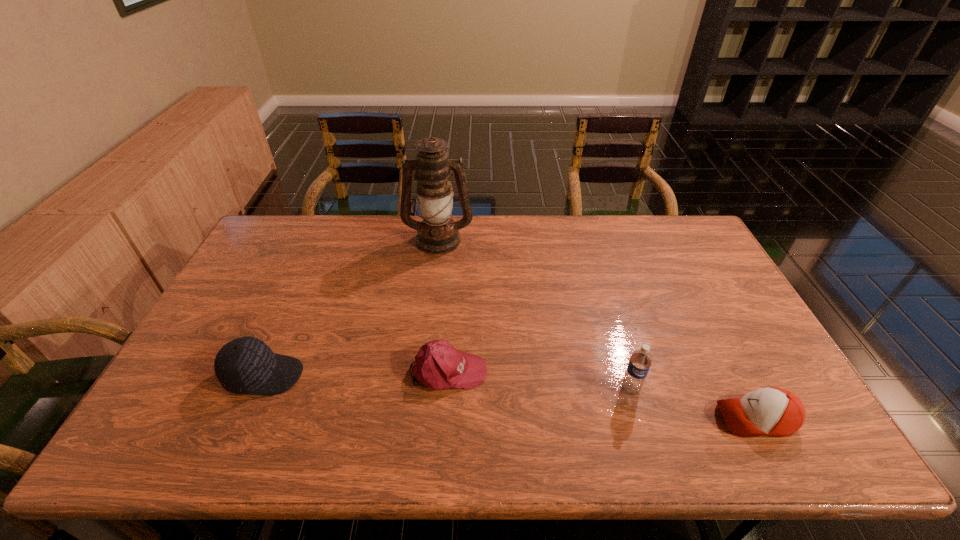
Identify the location of vacant region between the leftmost object and the second baseball cap from right to left. The height and width of the screenshot is (540, 960). (356, 373).

This screenshot has width=960, height=540. Find the location of `free space between the rightmost baseball cap and the tallest baseball cap`. free space between the rightmost baseball cap and the tallest baseball cap is located at coordinates (510, 397).

You are a GUI agent. You are given a task and a screenshot of the screen. Output one action in this format:
    pyautogui.click(x=<x>, y=<y>)
    Task: Click on the empty space between the tallest baseball cap and the tallest object
    
    Given the screenshot: What is the action you would take?
    pyautogui.click(x=351, y=307)

In order to click on vacant area that lies between the rightmost baseball cap and the second baseball cap from right to left in this screenshot , I will do `click(602, 394)`.

Locate an element on the screen. free space between the second baseball cap from left to right and the leftmost object is located at coordinates (356, 373).

This screenshot has width=960, height=540. In order to click on free area in between the rightmost object and the second baseball cap from right to left in this screenshot , I will do `click(602, 394)`.

Identify the location of object that is the third closest one to the nearest object. (437, 234).

Find the location of a particular element. The height and width of the screenshot is (540, 960). object that is the closest to the second baseball cap from left to right is located at coordinates (246, 365).

At what (x,y) coordinates should I click in order to perform the action: click on the second closest baseball cap relative to the tallest object. Please return your answer as a coordinate pair (x, y). Image resolution: width=960 pixels, height=540 pixels. Looking at the image, I should click on (246, 365).

Choose which baseball cap is the nearest neighbor to the rightmost object. Please provide its 2D coordinates. Your answer should be formatted as a tuple, i.e. [(x, y)], where the tuple contains the x and y coordinates of a point satisfying the conditions above.

[(438, 365)]